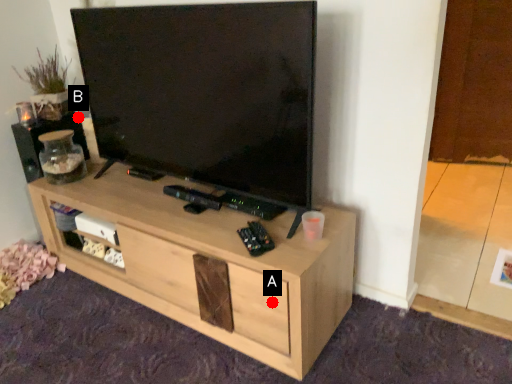
Question: Two points are circled on the image, labeled by A and B beside each circle. Which point appears closest to the camera in this image?

Choices:
 (A) A is closer
 (B) B is closer

Answer: (A)